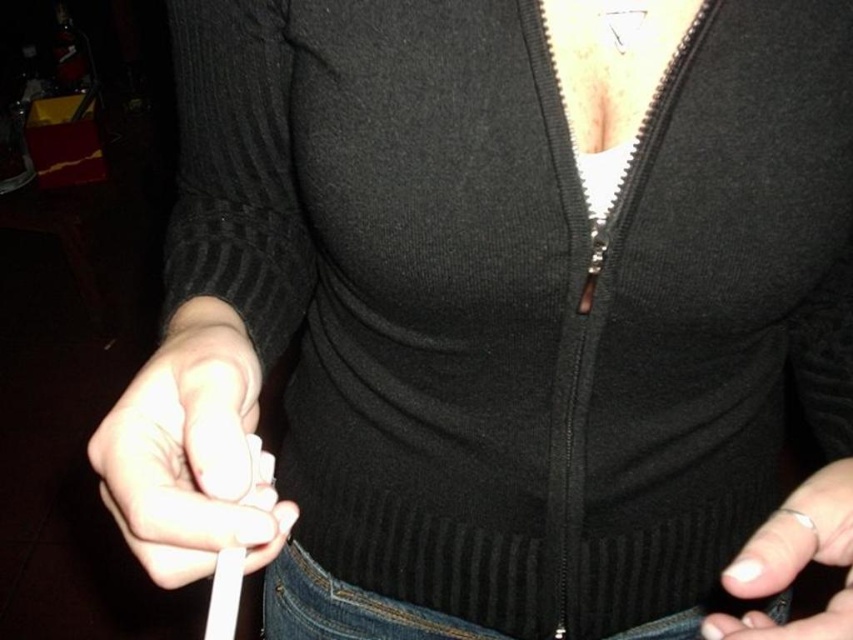
Question: In this image, where is white matte remote control at lower left located relative to white matte nail at lower right?

Choices:
 (A) below
 (B) above

Answer: (B)

Question: Based on their relative distances, which object is nearer to the jeans at lower center?

Choices:
 (A) white matte nail at lower right
 (B) white matte remote control at lower left

Answer: (A)

Question: Which point is closer to the camera?

Choices:
 (A) white matte remote control at lower left
 (B) jeans at lower center
 (C) white matte nail at lower right

Answer: (C)

Question: Does white matte nail at lower right appear on the right side of jeans at lower center?

Choices:
 (A) yes
 (B) no

Answer: (A)

Question: Does white matte remote control at lower left have a larger size compared to white matte nail at lower right?

Choices:
 (A) no
 (B) yes

Answer: (A)

Question: Which of the following is the farthest from the observer?

Choices:
 (A) (186, 492)
 (B) (735, 557)

Answer: (B)